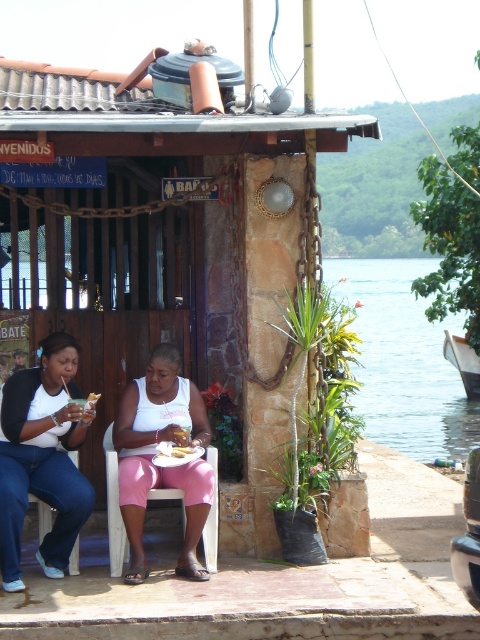
You are a photographer standing at the lakeside and want to take a photo that includes both the pink fabric skirt at center and the white paper plate at center. Which object will appear larger in the photo?

The pink fabric skirt at center will appear larger in the photo because it is closer to the viewer than the white paper plate at center.

You are a customer at the lakeside venue and want to place your white paper plate at center on the table. However, there is already a transparent water at lower center occupying the space. Can the plate fit on the table without overlapping the water?

The transparent water at lower center is much taller than the white paper plate at center, so placing the plate might be difficult due to the water taking up more vertical space. However, since the question mentions placing the plate on the table, the height of the water might not directly affect the plate placement unless the water is in a container like a glass. The description does not clarify the container, so it is uncertain if there is enough horizontal space.

You are standing at the entrance of the rustic structure and want to reach the transparent water at lower center marked by point (405, 362). Which direction should you walk to get there?

You should walk forward towards the transparent water at lower center marked by point (405, 362) since it is located at the lower center of the scene, directly in front of the entrance.